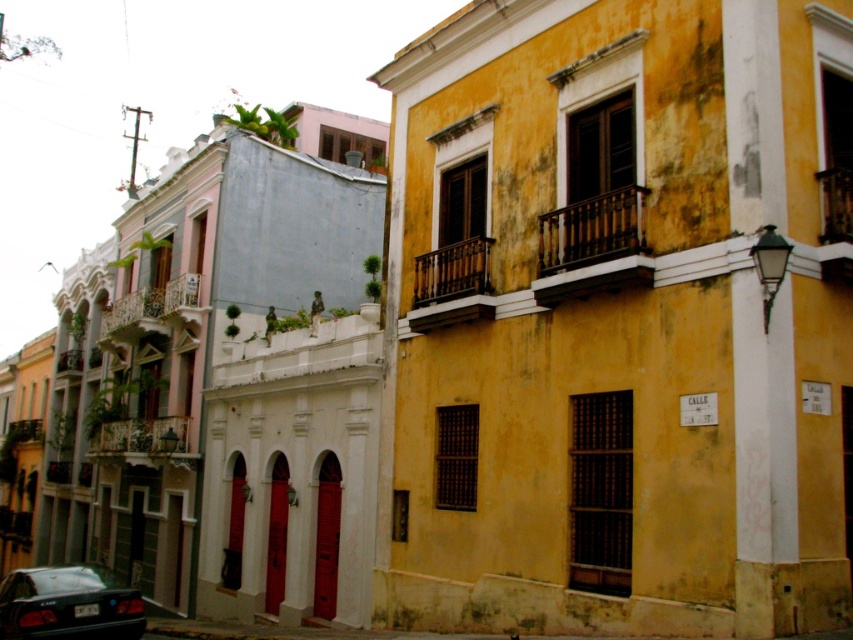
Question: Estimate the real-world distances between objects in this image. Which object is closer to the wooden at left?

Choices:
 (A) wooden at center
 (B) shiny black sedan at lower left
 (C) wooden at upper center
 (D) wooden balcony at lower left

Answer: (B)

Question: Is wooden at upper center to the left of wooden at center from the viewer's perspective?

Choices:
 (A) yes
 (B) no

Answer: (B)

Question: Observing the image, what is the correct spatial positioning of wooden at upper center in reference to shiny black sedan at lower left?

Choices:
 (A) right
 (B) left

Answer: (A)

Question: Which is nearer to the wooden at center?

Choices:
 (A) wooden at left
 (B) wooden at upper center

Answer: (B)

Question: Is wooden at upper center behind wooden at left?

Choices:
 (A) no
 (B) yes

Answer: (A)

Question: Which object appears farthest from the camera in this image?

Choices:
 (A) wooden at upper center
 (B) wooden at center
 (C) wooden at left
 (D) shiny black sedan at lower left

Answer: (C)